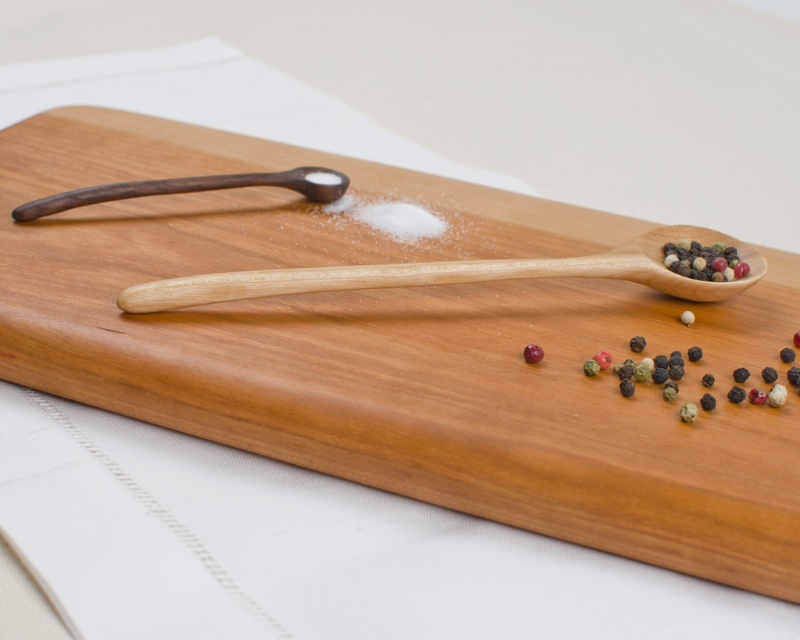
Question: Considering the relative positions of light wood spoon at center and dark wood spoon at upper left in the image provided, where is light wood spoon at center located with respect to dark wood spoon at upper left?

Choices:
 (A) below
 (B) above

Answer: (A)

Question: Does light wood spoon at center have a greater width compared to multicolored peppercorns at right?

Choices:
 (A) yes
 (B) no

Answer: (A)

Question: Which point appears farthest from the camera in this image?

Choices:
 (A) (728, 253)
 (B) (532, 346)
 (C) (452, 276)

Answer: (A)

Question: From the image, what is the correct spatial relationship of dark wood spoon at upper left in relation to multicolored peppercorns at right?

Choices:
 (A) left
 (B) right

Answer: (A)

Question: Which point is farther to the camera?

Choices:
 (A) (364, 276)
 (B) (202, 179)
 (C) (542, 349)

Answer: (B)

Question: Estimate the real-world distances between objects in this image. Which object is closer to the light wood spoon at center?

Choices:
 (A) dark wood spoon at upper left
 (B) multicolored peppercorns at right
 (C) glossy red pepper at center

Answer: (B)